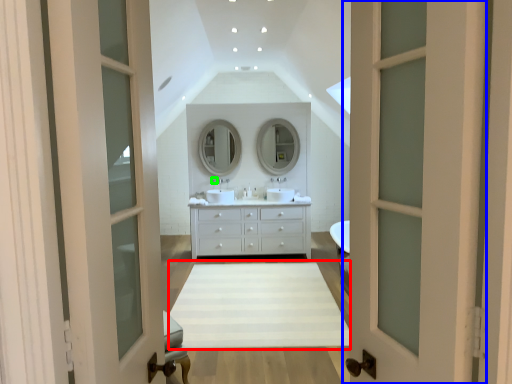
Question: Estimate the real-world distances between objects in this image. Which object is closer to plain (highlighted by a red box), door (highlighted by a blue box) or faucet (highlighted by a green box)?

Choices:
 (A) door
 (B) faucet

Answer: (B)